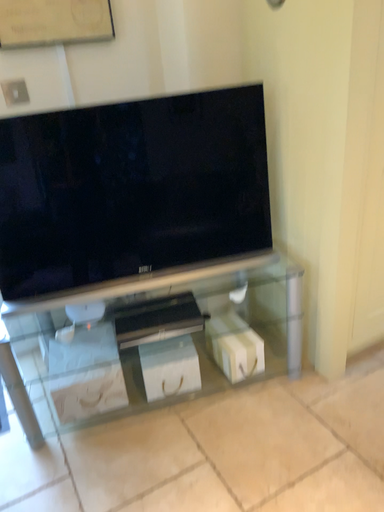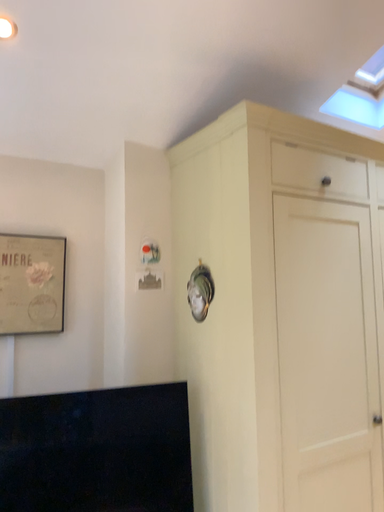
Question: How did the camera likely rotate when shooting the video?

Choices:
 (A) rotated upward
 (B) rotated downward

Answer: (A)